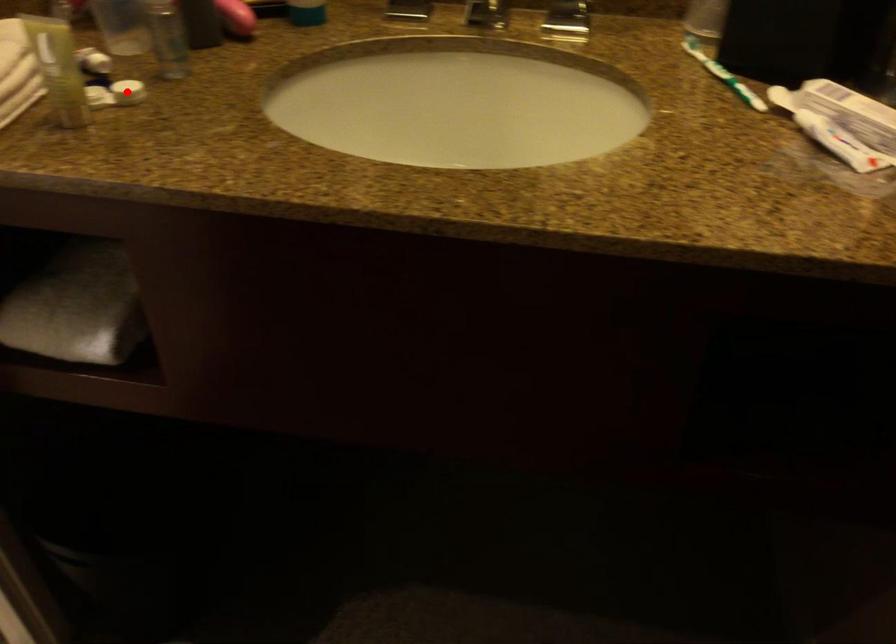
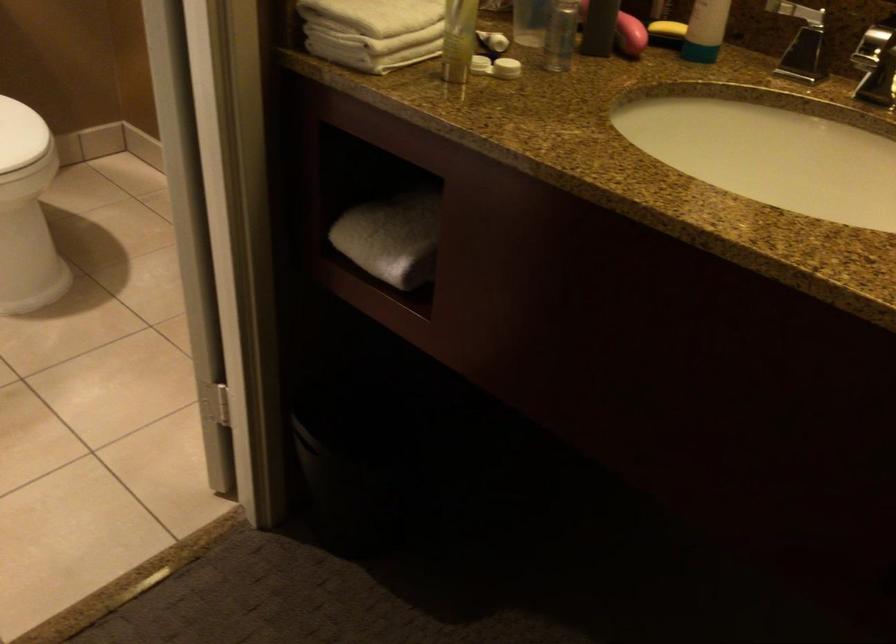
In the second image, find the point that corresponds to the highlighted location in the first image.

(506, 68)